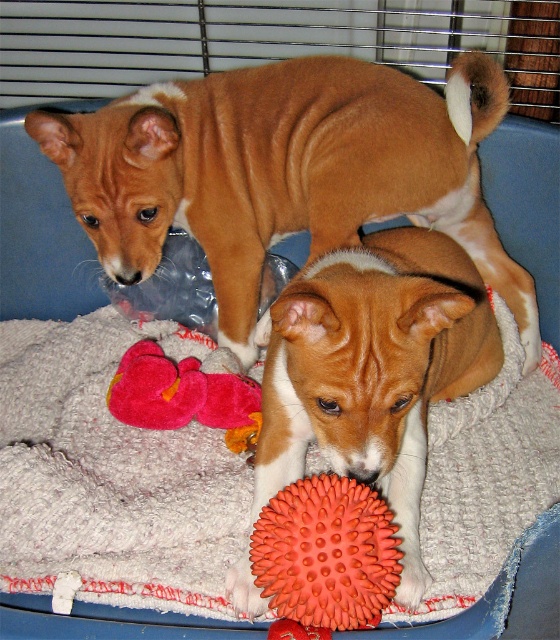
Question: Which object appears farthest from the camera in this image?

Choices:
 (A) brown smooth dog at upper center
 (B) orange spiky ball at center

Answer: (A)

Question: Where is white textured dog bed at center located in relation to fuzzy pink plush at lower left in the image?

Choices:
 (A) right
 (B) left

Answer: (A)

Question: Is the position of white textured dog bed at center more distant than that of fuzzy pink plush at lower left?

Choices:
 (A) yes
 (B) no

Answer: (B)

Question: Among these points, which one is nearest to the camera?

Choices:
 (A) (470, 147)
 (B) (137, 358)

Answer: (B)

Question: Which point is closer to the camera?

Choices:
 (A) (154, 132)
 (B) (262, 426)
 (C) (118, 380)

Answer: (B)

Question: Is brown smooth dog at upper center to the left of orange spiky ball at center from the viewer's perspective?

Choices:
 (A) no
 (B) yes

Answer: (B)